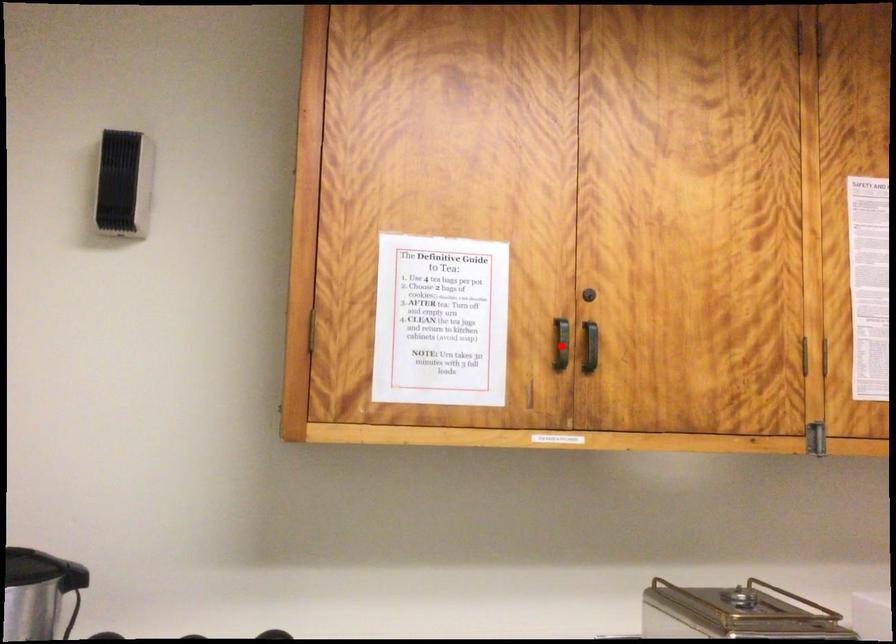
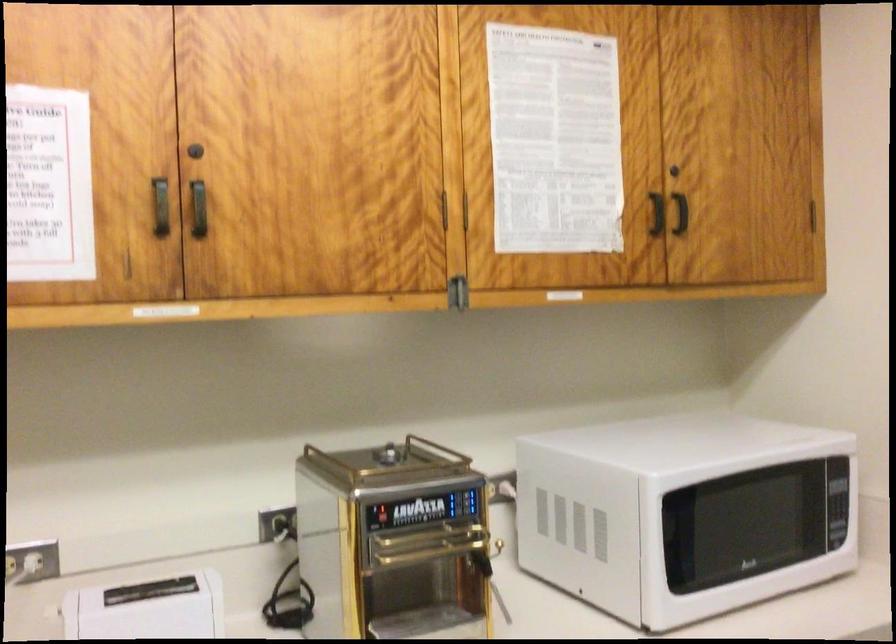
Question: I am providing you with two images of the same scene from different viewpoints. A red point is marked on the first image. Is the red point's position out of view in image 2?

Choices:
 (A) Yes
 (B) No

Answer: (B)